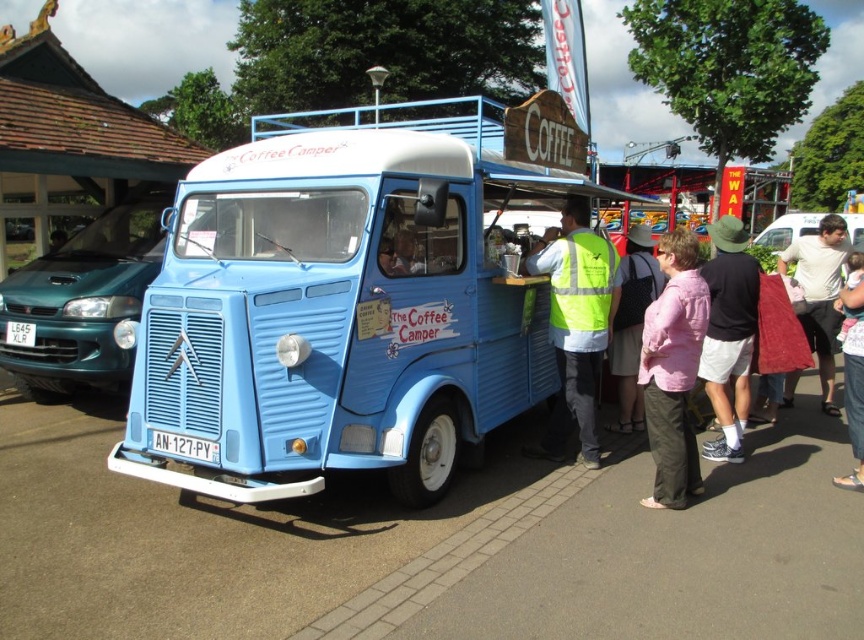
Does denim pants at lower right appear on the left side of matte black coffee cup at center?

Incorrect, denim pants at lower right is not on the left side of matte black coffee cup at center.

Can you confirm if denim pants at lower right is shorter than matte black coffee cup at center?

In fact, denim pants at lower right may be taller than matte black coffee cup at center.

At what (x,y) coordinates should I click in order to perform the action: click on denim pants at lower right. Please return your answer as a coordinate pair (x, y). The width and height of the screenshot is (864, 640). Looking at the image, I should click on (853, 374).

Which of these two, teal glossy sedan at left or high-visibility vest at center, stands shorter?

high-visibility vest at center

Who is positioned more to the left, teal glossy sedan at left or high-visibility vest at center?

teal glossy sedan at left

Does point (14, 352) come behind point (567, 285)?

Yes, point (14, 352) is behind point (567, 285).

The width and height of the screenshot is (864, 640). I want to click on teal glossy sedan at left, so click(81, 304).

Can you confirm if high-visibility vest at center is thinner than matte yellow vest at center?

No.

Can you confirm if high-visibility vest at center is taller than matte yellow vest at center?

Correct, high-visibility vest at center is much taller as matte yellow vest at center.

Identify the location of high-visibility vest at center. This screenshot has height=640, width=864. (575, 323).

In order to click on high-visibility vest at center in this screenshot , I will do `click(575, 323)`.